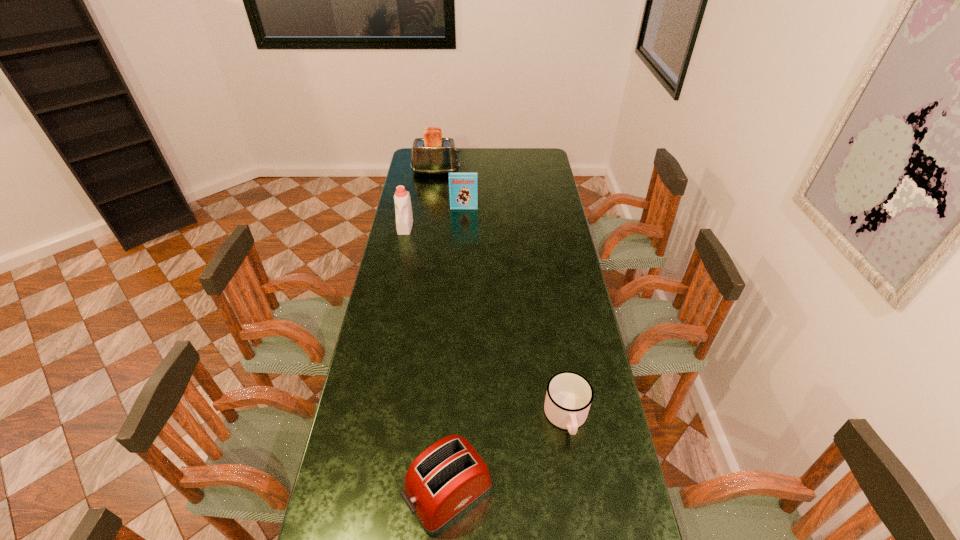
Locate an element on the screen. the taller toaster is located at coordinates (432, 154).

The image size is (960, 540). I want to click on the farthest object, so click(x=432, y=154).

Image resolution: width=960 pixels, height=540 pixels. I want to click on the third farthest object, so click(404, 218).

Image resolution: width=960 pixels, height=540 pixels. I want to click on book, so click(463, 187).

Identify the location of the shorter toaster. (448, 478).

At what (x,y) coordinates should I click in order to perform the action: click on the nearest object. Please return your answer as a coordinate pair (x, y). The width and height of the screenshot is (960, 540). Looking at the image, I should click on point(448,478).

The image size is (960, 540). In order to click on the second nearest object in this screenshot , I will do `click(569, 395)`.

This screenshot has width=960, height=540. In order to click on the shortest object in this screenshot , I will do `click(569, 395)`.

You are a GUI agent. You are given a task and a screenshot of the screen. Output one action in this format:
    pyautogui.click(x=<x>, y=<y>)
    Task: Click on the free space located 0.140m on the side of the tallest object with the control lever
    
    Given the screenshot: What is the action you would take?
    pyautogui.click(x=486, y=172)

What are the coordinates of `vacant position located on the handle side of the detergent` in the screenshot? It's located at (399, 252).